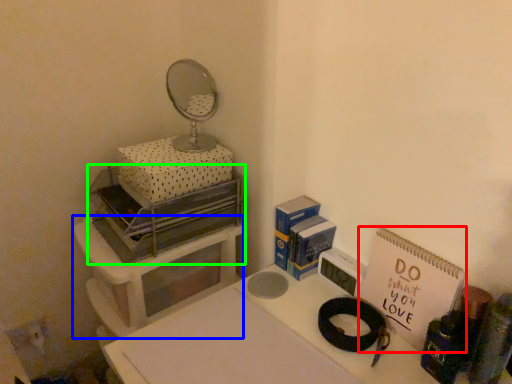
Question: Estimate the real-world distances between objects in this image. Which object is farther from notebook (highlighted by a red box), furniture (highlighted by a blue box) or appliance (highlighted by a green box)?

Choices:
 (A) furniture
 (B) appliance

Answer: (A)